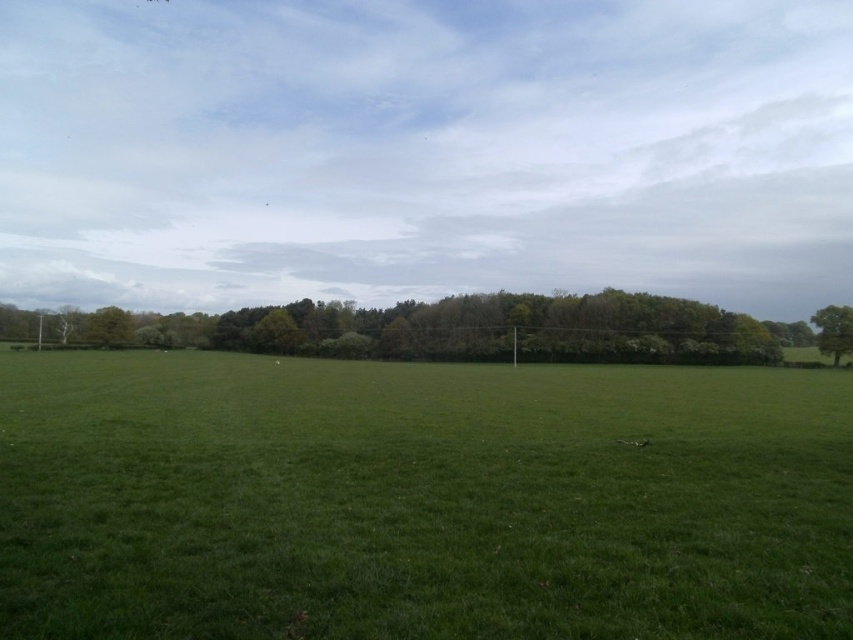
You are planning to set up a picnic blanket in the green grass at center. You want to ensure that you are at least 300 feet away from the green leafy tree at right for privacy. Is the current distance sufficient?

The green grass at center and green leafy tree at right are 263.98 feet apart from each other. Since 263.98 feet is less than 300 feet, the current distance is not sufficient for the desired privacy requirement.

You are standing in the middle of the field and see the green grass at center and the green leafy trees at center. Which object is located to the right side from your perspective?

The green grass at center is to the right of the green leafy trees at center, so the green grass at center is located to the right side from your perspective.

You are planning to set up a picnic blanket in the open grassy field. You want to place it between the green leafy trees at center and the green leafy tree at right. Which side of the picnic blanket should be closer to the denser part of the trees?

The green leafy trees at center are wider than the green leafy tree at right, so the denser part of the trees is at the center. Therefore, the side of the picnic blanket closer to the green leafy trees at center would be nearer to the denser part.